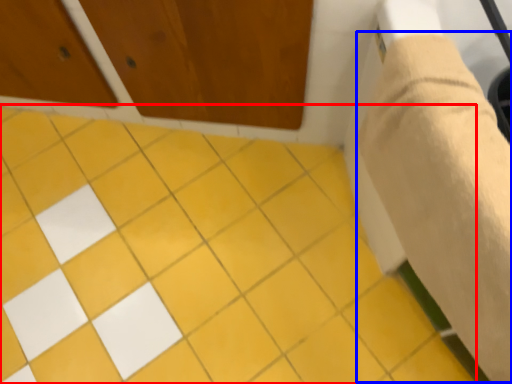
Question: Among these objects, which one is nearest to the camera, ceramic tile (highlighted by a red box) or plaster bandage (highlighted by a blue box)?

Choices:
 (A) ceramic tile
 (B) plaster bandage

Answer: (B)